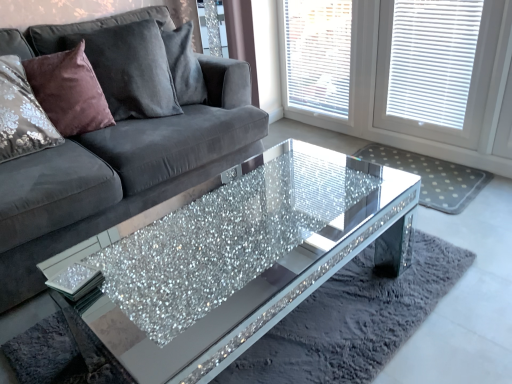
The height and width of the screenshot is (384, 512). I want to click on free point below white dotted mat at center (from a real-world perspective), so click(436, 176).